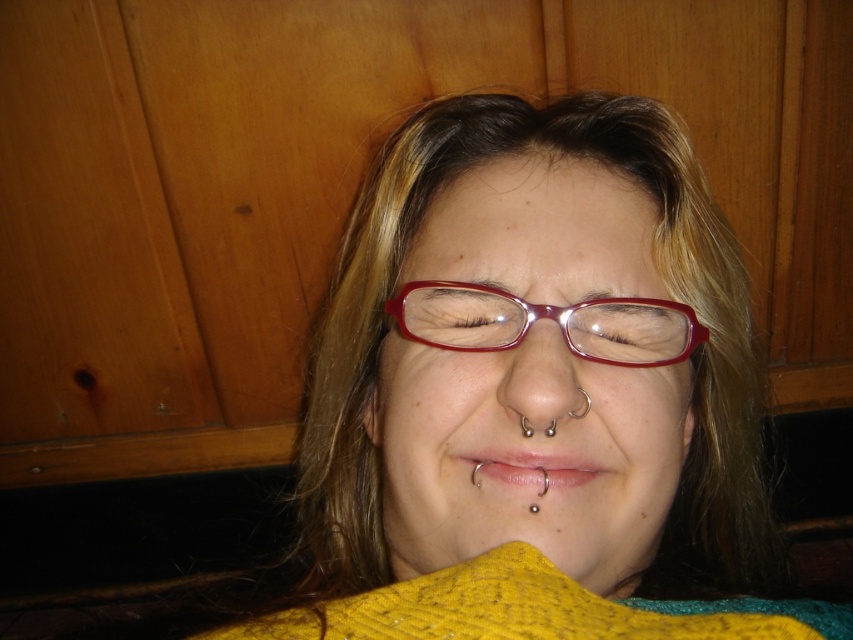
Question: Considering the relative positions of matte yellow sweater at center and silver metallic lip piercing at center in the image provided, where is matte yellow sweater at center located with respect to silver metallic lip piercing at center?

Choices:
 (A) below
 (B) above

Answer: (A)

Question: In this image, where is matte yellow sweater at center located relative to silver metallic lip piercing at center?

Choices:
 (A) below
 (B) above

Answer: (A)

Question: Among these points, which one is farthest from the camera?

Choices:
 (A) (653, 440)
 (B) (506, 483)

Answer: (A)

Question: Can you confirm if matte yellow sweater at center is smaller than silver metallic lip piercing at center?

Choices:
 (A) yes
 (B) no

Answer: (B)